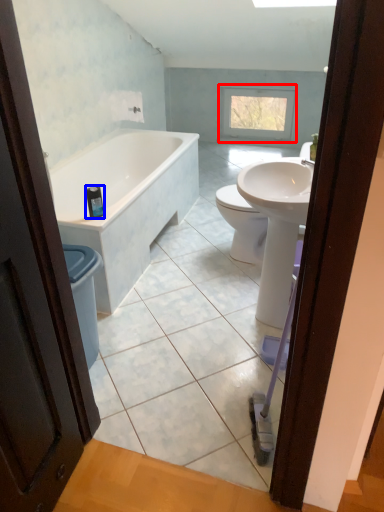
Question: Which object is further to the camera taking this photo, window (highlighted by a red box) or toiletry (highlighted by a blue box)?

Choices:
 (A) window
 (B) toiletry

Answer: (A)